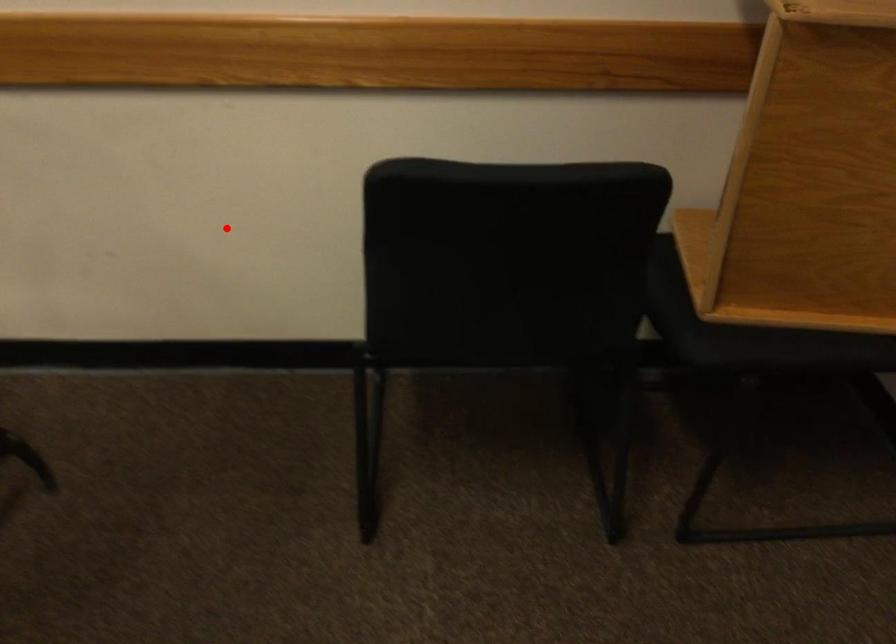
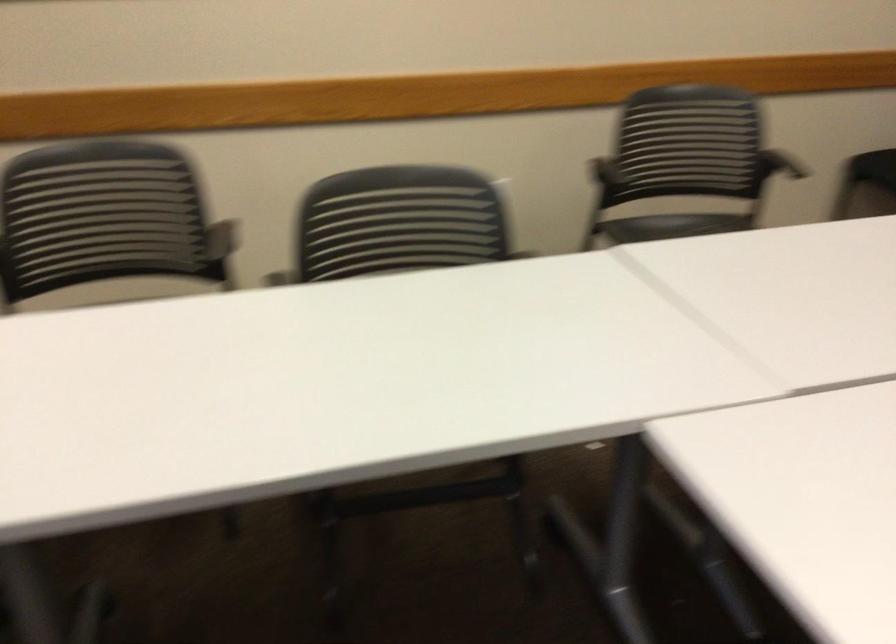
Find the pixel in the second image that matches the highlighted location in the first image.

(790, 166)